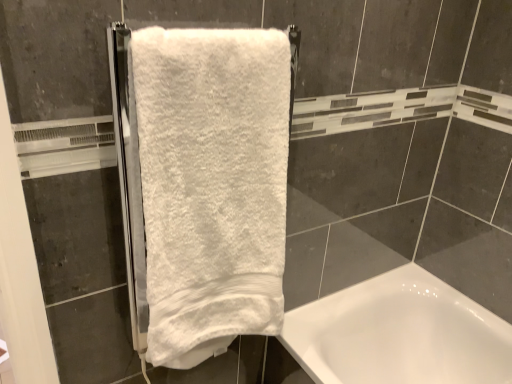
What do you see at coordinates (211, 185) in the screenshot?
I see `white terry cloth towel at center` at bounding box center [211, 185].

Image resolution: width=512 pixels, height=384 pixels. In order to click on white terry cloth towel at center in this screenshot , I will do `click(211, 185)`.

Locate an element on the screen. The height and width of the screenshot is (384, 512). white terry cloth towel at center is located at coordinates (211, 185).